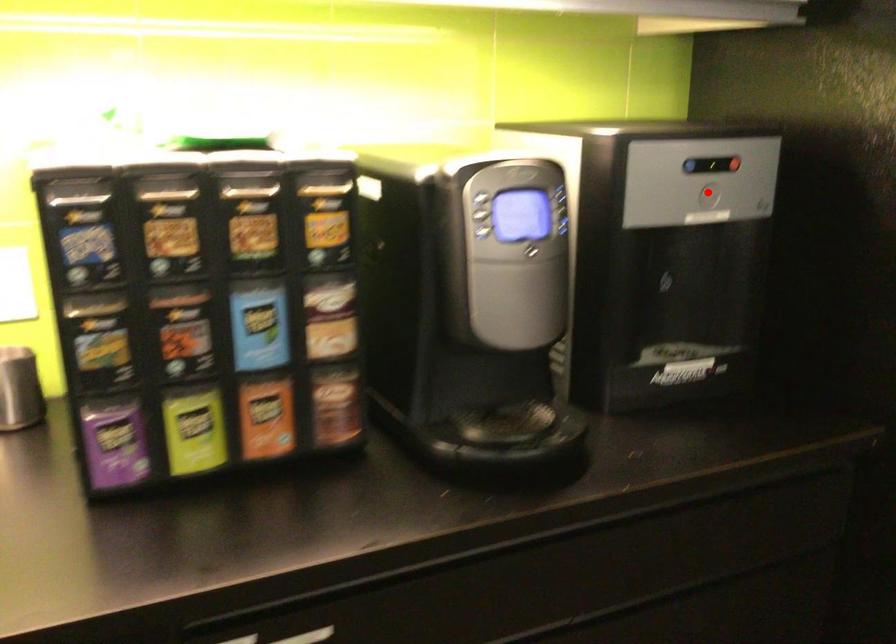
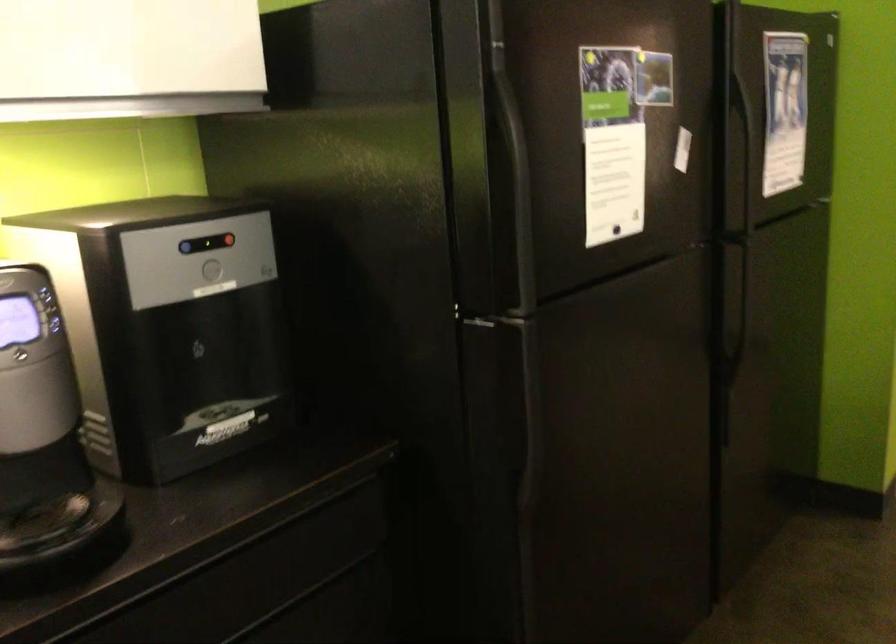
In the second image, find the point that corresponds to the highlighted location in the first image.

(211, 269)